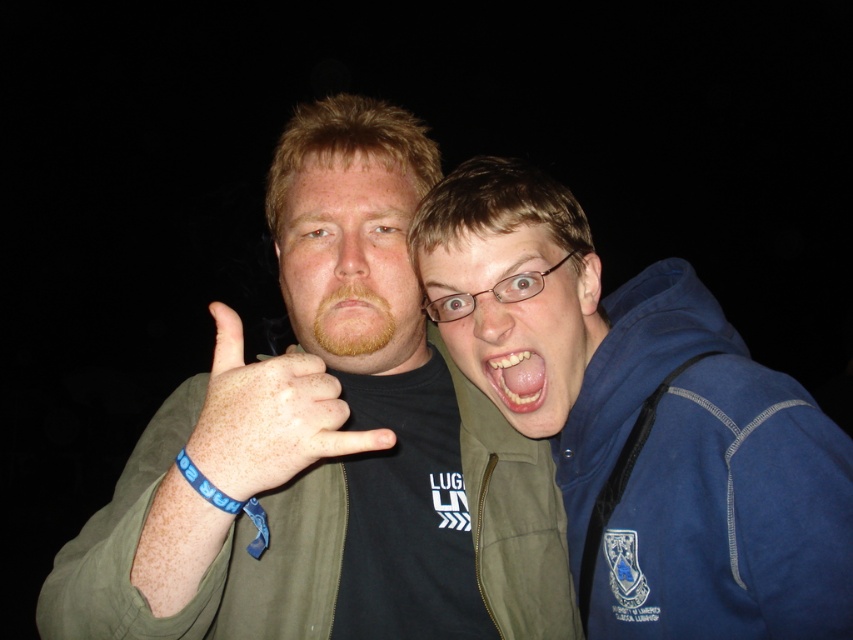
Which is more to the right, blue rubber band at center or white glossy teeth at center?

white glossy teeth at center

Measure the distance between point (270, 417) and camera.

25.81 inches

Find the location of a particular element. The width and height of the screenshot is (853, 640). blue rubber band at center is located at coordinates (268, 417).

Consider the image. Is green matte jacket at center smaller than light brown hair at center?

Incorrect, green matte jacket at center is not smaller in size than light brown hair at center.

Is green matte jacket at center taller than light brown hair at center?

Yes, green matte jacket at center is taller than light brown hair at center.

Locate an element on the screen. The width and height of the screenshot is (853, 640). green matte jacket at center is located at coordinates (328, 445).

Can you confirm if blue fleece jacket at right is positioned above light brown hair at center?

Actually, blue fleece jacket at right is below light brown hair at center.

Can you confirm if blue fleece jacket at right is smaller than light brown hair at center?

Incorrect, blue fleece jacket at right is not smaller in size than light brown hair at center.

Is point (462, 237) positioned after point (372, 308)?

No.

This screenshot has height=640, width=853. Identify the location of blue fleece jacket at right. (653, 420).